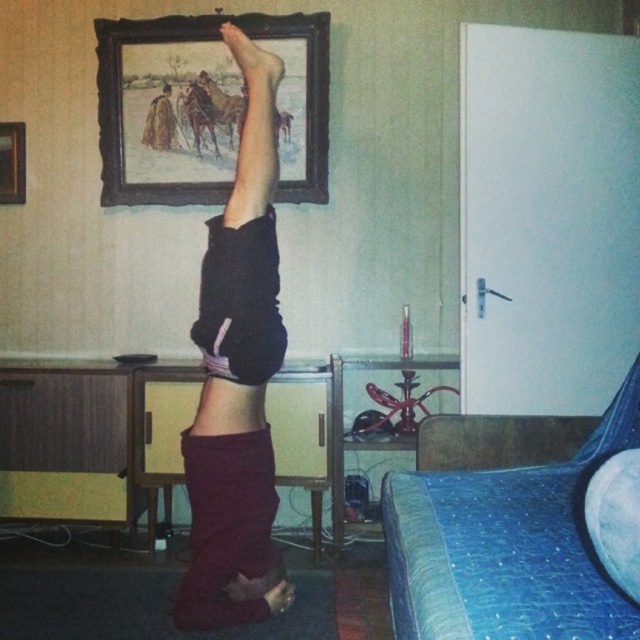
Is maroon fabric pants at center above brown wooden frame at upper center?

Incorrect, maroon fabric pants at center is not positioned above brown wooden frame at upper center.

Can you confirm if maroon fabric pants at center is taller than brown wooden frame at upper center?

Yes.

Who is more forward, (193,442) or (291,35)?

Point (193,442) is in front.

Where is `maroon fabric pants at center`? maroon fabric pants at center is located at coordinates (237, 380).

Who is more forward, [468,552] or [3,122]?

Point [468,552] is more forward.

Does point (452, 493) come behind point (10, 163)?

No, it is in front of (10, 163).

What do you see at coordinates (506, 547) in the screenshot?
I see `blue textured bed at lower right` at bounding box center [506, 547].

At what (x,y) coordinates should I click in order to perform the action: click on blue textured bed at lower right. Please return your answer as a coordinate pair (x, y). The width and height of the screenshot is (640, 640). Looking at the image, I should click on (506, 547).

Which is more to the left, brown wooden frame at upper center or wooden picture frame at upper left?

Positioned to the left is wooden picture frame at upper left.

Is brown wooden frame at upper center bigger than wooden picture frame at upper left?

Yes, brown wooden frame at upper center is bigger than wooden picture frame at upper left.

Identify the location of brown wooden frame at upper center. (205, 106).